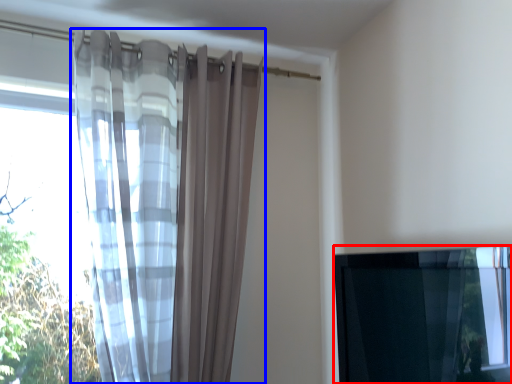
Question: Which of the following is the closest to the observer, window (highlighted by a red box) or curtain (highlighted by a blue box)?

Choices:
 (A) window
 (B) curtain

Answer: (A)